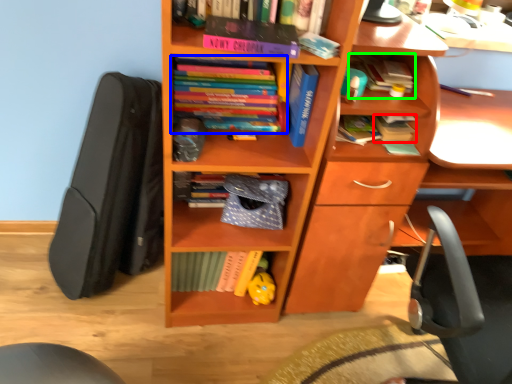
Question: Which is farther away from book (highlighted by a red box)? book (highlighted by a blue box) or book (highlighted by a green box)?

Choices:
 (A) book
 (B) book

Answer: (A)